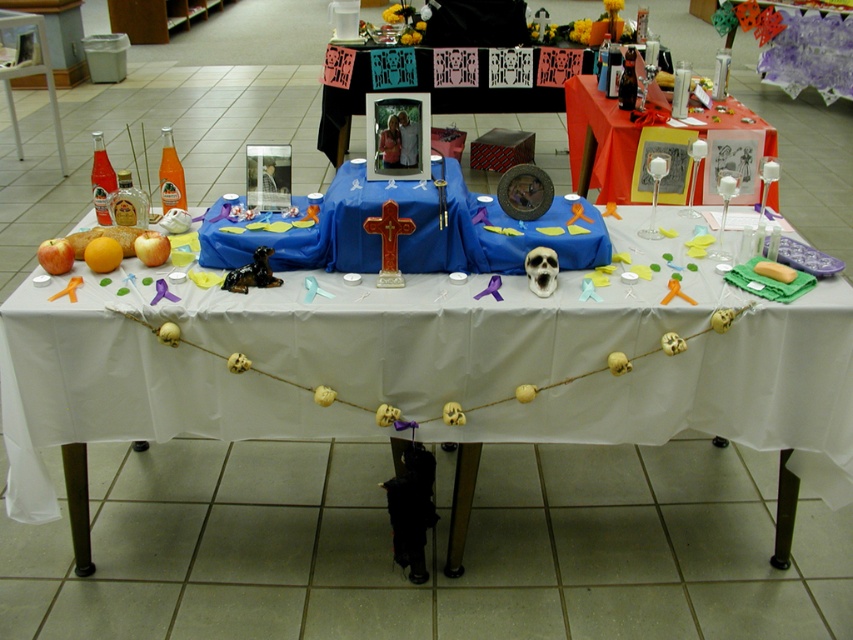
You are setting up a memorial altar and need to place a large candle holder. The white fabric table at center and the translucent glass candlesticks at upper right are available. Which object can better accommodate the large candle holder based on their sizes?

The white fabric table at center has a larger size compared to the translucent glass candlesticks at upper right, so it can better accommodate the large candle holder.

Looking at this image, you are organizing a memorial event and need to place a new decoration between the matte black frame at upper center and the translucent glass candlesticks at upper right. Based on their current positions, which object should the decoration be closer to?

The decoration should be placed closer to the translucent glass candlesticks at upper right because the matte black frame at upper center is positioned to the left of them, meaning the candlesticks are further to the right.